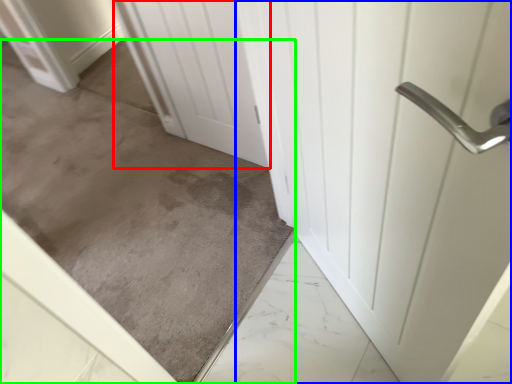
Question: Which is nearer to the door (highlighted by a red box)? door (highlighted by a blue box) or concrete (highlighted by a green box).

Choices:
 (A) door
 (B) concrete

Answer: (B)